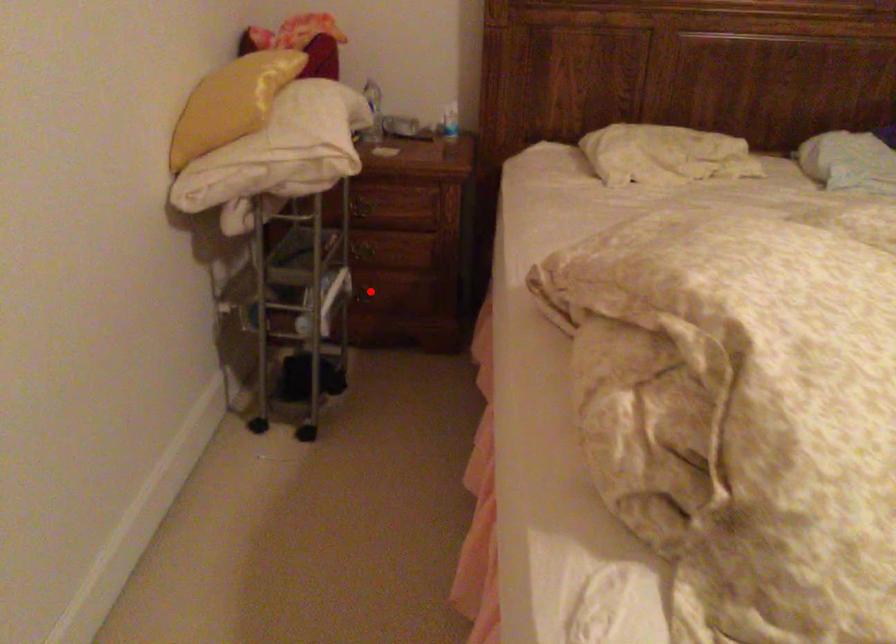
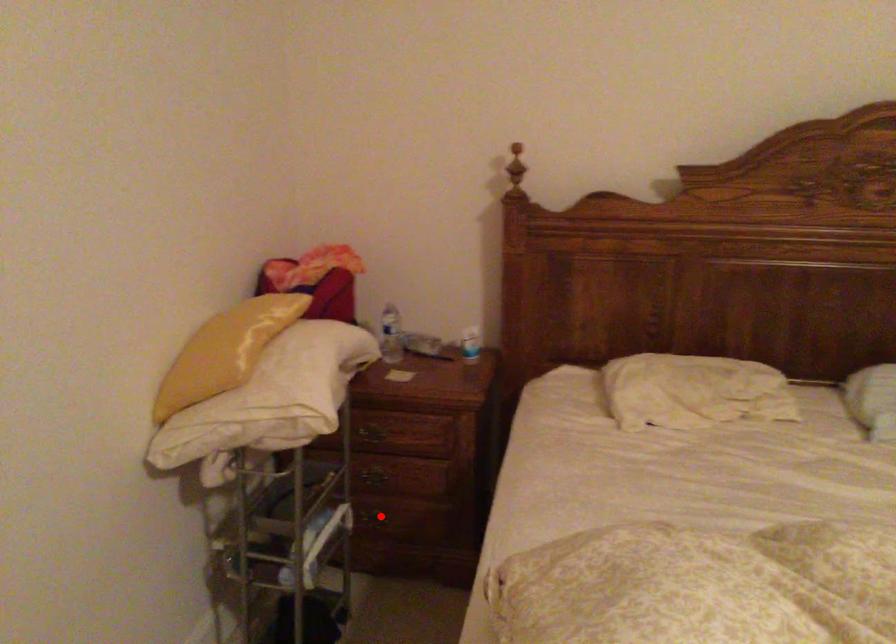
I am providing you with two images of the same scene from different viewpoints. A red point is marked on the first image and another point is marked on the second image. Do the highlighted points in image1 and image2 indicate the same real-world spot?

Yes